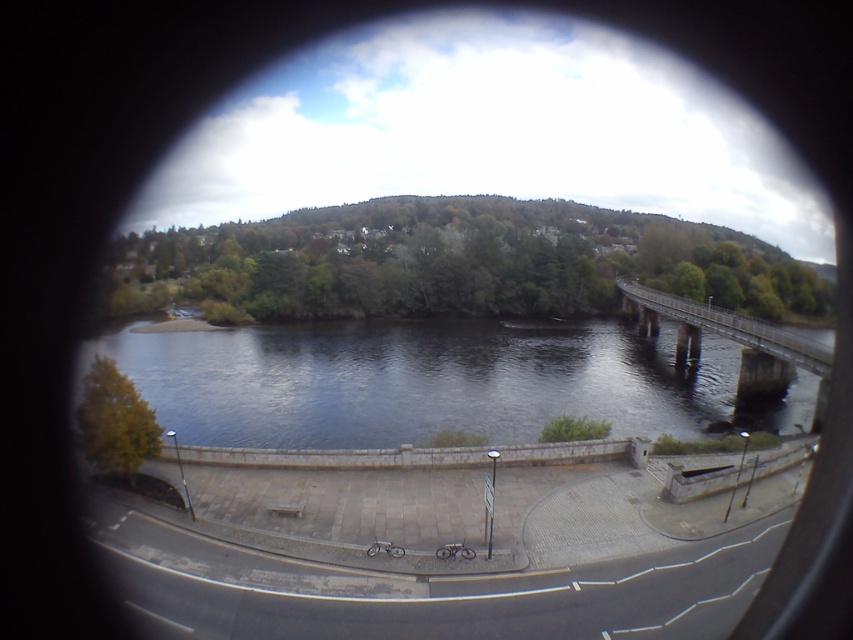
Question: Is the position of dark blue water at center less distant than that of metallic gray bridge at right?

Choices:
 (A) yes
 (B) no

Answer: (A)

Question: Which point appears closest to the camera in this image?

Choices:
 (A) (749, 324)
 (B) (206, 355)

Answer: (A)

Question: Can you confirm if dark blue water at center is positioned below metallic gray bridge at right?

Choices:
 (A) yes
 (B) no

Answer: (A)

Question: Does dark blue water at center have a smaller size compared to metallic gray bridge at right?

Choices:
 (A) yes
 (B) no

Answer: (B)

Question: Which of the following is the farthest from the observer?

Choices:
 (A) (712, 314)
 (B) (161, 400)

Answer: (A)

Question: Among these objects, which one is nearest to the camera?

Choices:
 (A) metallic gray bridge at right
 (B) dark blue water at center

Answer: (B)